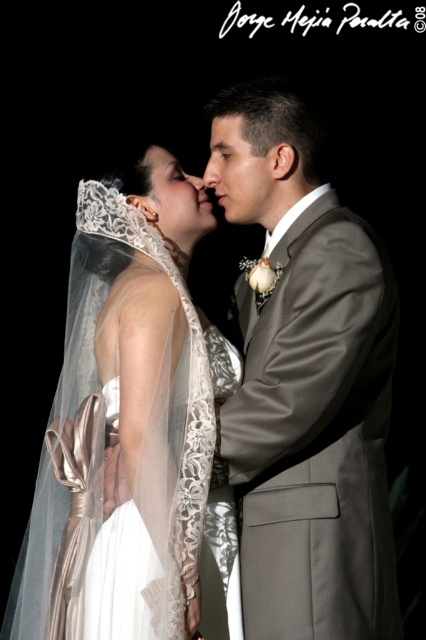
You are a photographer capturing the wedding couple. You notice the white lace veil at upper left and the matte skin nose at center. Which object is bigger in size?

The white lace veil at upper left has a larger size compared to the matte skin nose at center.

In the wedding scene, you notice the white lace veil at upper left and the smooth skin face at center. Which object is bigger in size?

The white lace veil at upper left is larger in size compared to the smooth skin face at center.

Looking at the bride and groom in the wedding scene, which object is located to the right of the other between the smooth skin face at center and the matte white nose at center?

The smooth skin face at center is positioned on the right side of the matte white nose at center.